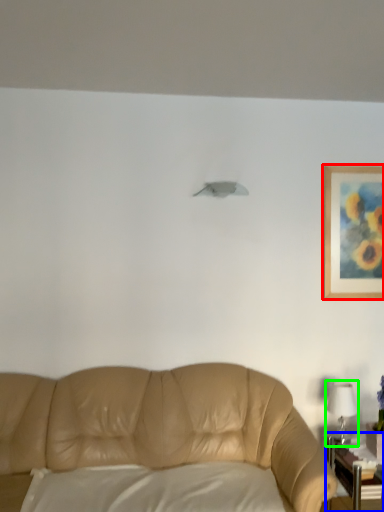
Question: Estimate the real-world distances between objects in this image. Which object is closer to picture frame (highlighted by a red box), table (highlighted by a blue box) or table lamp (highlighted by a green box)?

Choices:
 (A) table
 (B) table lamp

Answer: (B)